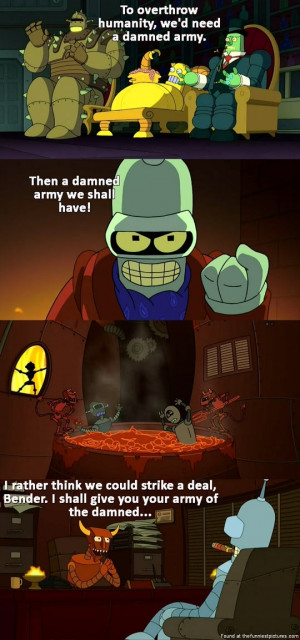
Image resolution: width=300 pixels, height=640 pixels. I want to click on vent, so click(x=227, y=358).